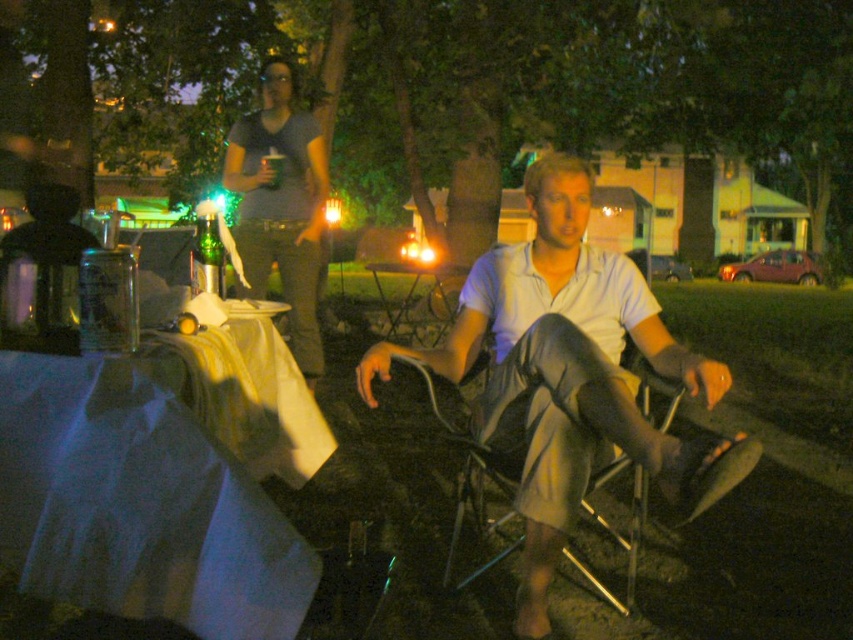
You are sitting at a table in the middle of a nighttime gathering. You need to reach for your light blue cotton shirt at center and metallic silver chair at center. Which one is closer to your left side?

The light blue cotton shirt at center is closer to your left side because it is positioned to the left of the metallic silver chair at center.